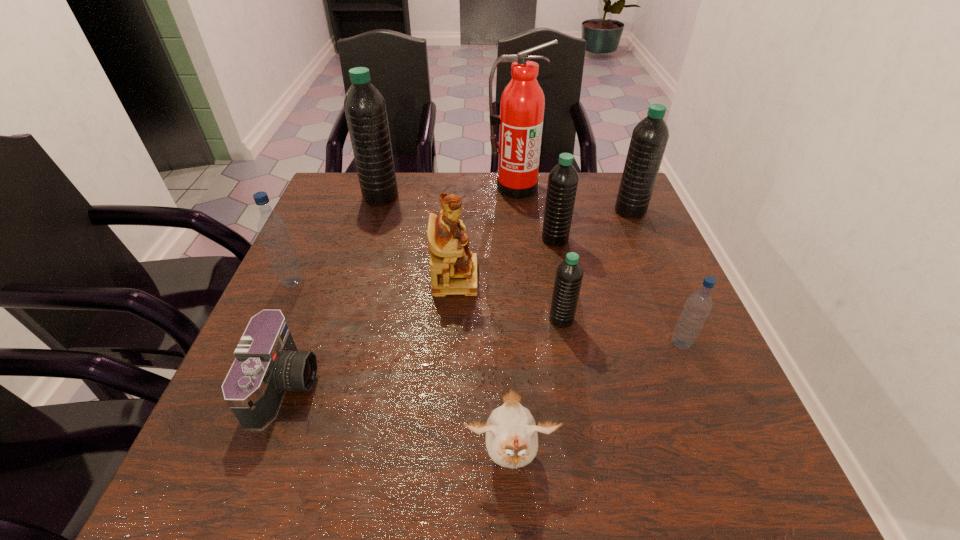
Choose which water bottle is the second nearest neighbor to the black camera. Please provide its 2D coordinates. Your answer should be formatted as a tuple, i.e. [(x, y)], where the tuple contains the x and y coordinates of a point satisfying the conditions above.

[(569, 274)]

At what (x,y) coordinates should I click in order to perform the action: click on black water bottle that stands as the second closest to the camera. Please return your answer as a coordinate pair (x, y). This screenshot has height=540, width=960. Looking at the image, I should click on (365, 108).

Point out which black water bottle is positioned as the second nearest to the third farthest water bottle. Please provide its 2D coordinates. Your answer should be formatted as a tuple, i.e. [(x, y)], where the tuple contains the x and y coordinates of a point satisfying the conditions above.

[(569, 274)]

You are a GUI agent. You are given a task and a screenshot of the screen. Output one action in this format:
    pyautogui.click(x=<x>, y=<y>)
    Task: Click on the blank space that satisfies the following two spatial constraints: 1. on the front side of the third farthest water bottle; 2. on the front-facing side of the black camera
    The image size is (960, 540).
    Given the screenshot: What is the action you would take?
    pyautogui.click(x=584, y=385)

At what (x,y) coordinates should I click in order to perform the action: click on vacant position in the image that satisfies the following two spatial constraints: 1. on the label side of the fire extinguisher; 2. on the front-facing side of the camera. Please return your answer as a coordinate pair (x, y). Looking at the image, I should click on (536, 385).

The image size is (960, 540). I want to click on free point that satisfies the following two spatial constraints: 1. on the front-facing side of the smallest black water bottle; 2. on the right side of the figurine, so click(453, 320).

Locate an element on the screen. This screenshot has height=540, width=960. vacant space that satisfies the following two spatial constraints: 1. on the label side of the fire extinguisher; 2. on the left side of the second tallest water bottle is located at coordinates (517, 211).

Find the location of a particular element. vacant space that satisfies the following two spatial constraints: 1. on the front side of the nearer blue water bottle; 2. on the front-facing side of the shortest object is located at coordinates (698, 385).

Where is `free space that satisfies the following two spatial constraints: 1. on the front-facing side of the figurine; 2. on the back side of the fifth farthest water bottle`? The width and height of the screenshot is (960, 540). free space that satisfies the following two spatial constraints: 1. on the front-facing side of the figurine; 2. on the back side of the fifth farthest water bottle is located at coordinates (x=453, y=320).

I want to click on free space that satisfies the following two spatial constraints: 1. on the front side of the second water bottle from left to right; 2. on the right side of the nearest black water bottle, so click(x=344, y=320).